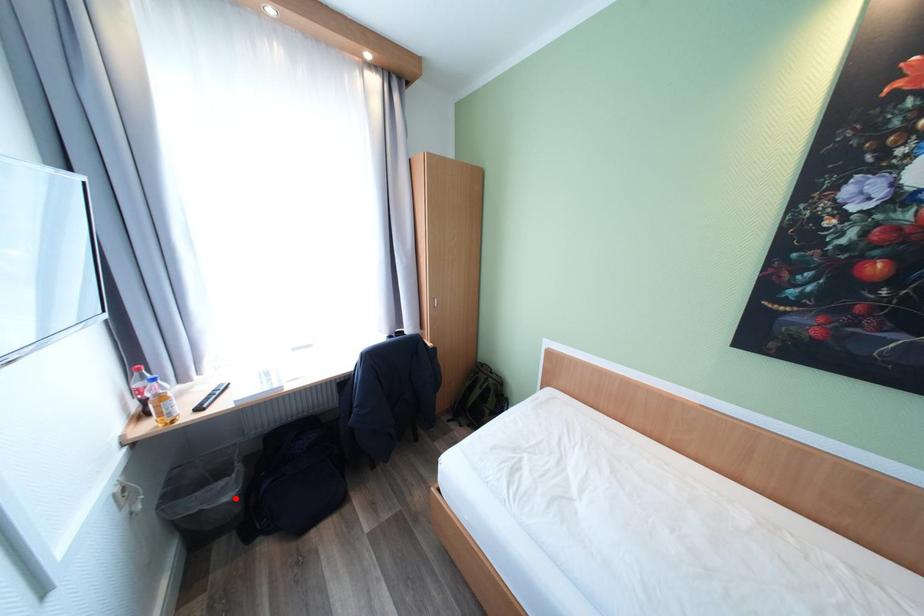
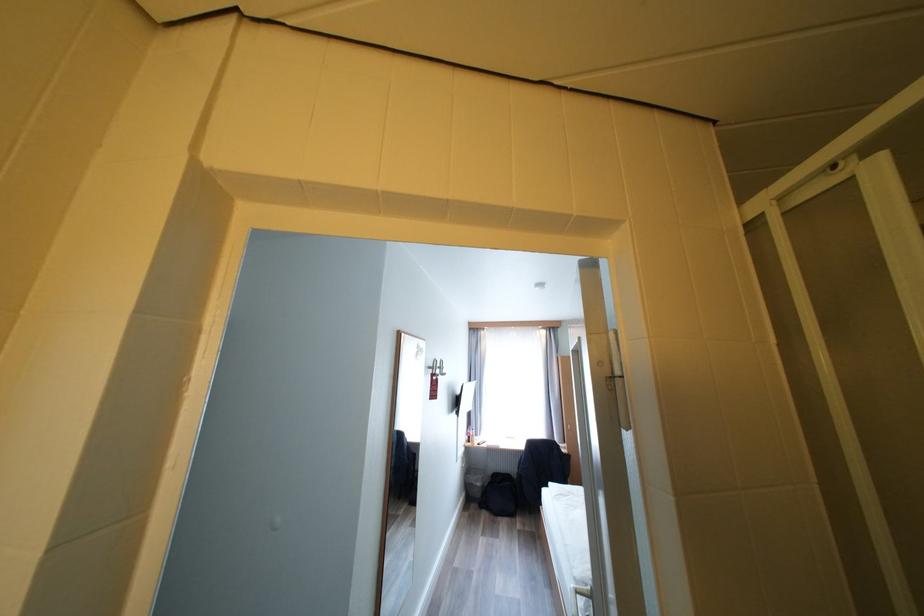
Question: I am providing you with two images of the same scene from different viewpoints. Given a red point in image1, look at the same physical point in image2. Is it:

Choices:
 (A) Closer to the viewpoint
 (B) Farther from the viewpoint

Answer: (B)